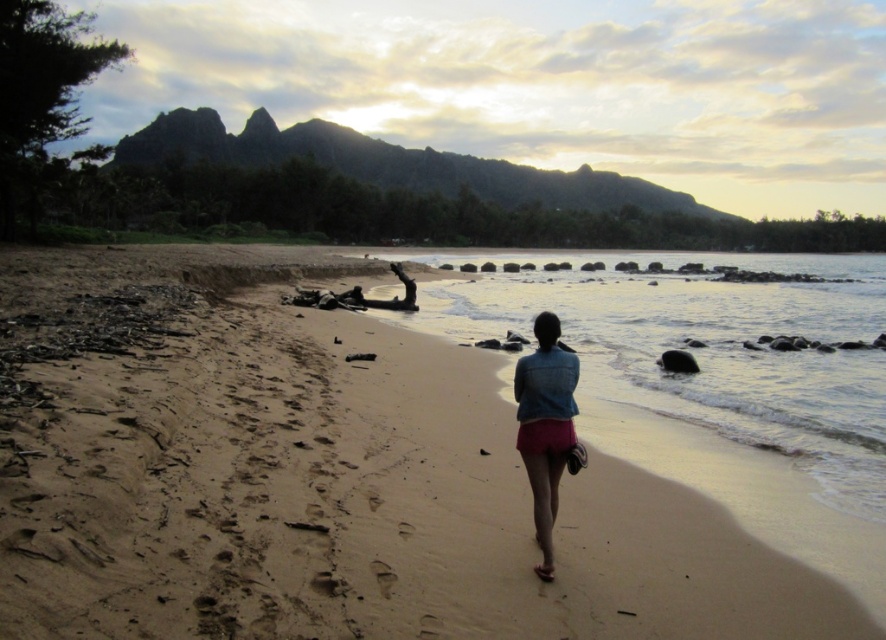
Question: Considering the relative positions of sandy beach at center and pink denim shorts at center in the image provided, where is sandy beach at center located with respect to pink denim shorts at center?

Choices:
 (A) left
 (B) right

Answer: (A)

Question: Which is farther from the pink denim shorts at center?

Choices:
 (A) sandy beach at center
 (B) clear water at center

Answer: (B)

Question: Does sandy beach at center have a smaller size compared to pink denim shorts at center?

Choices:
 (A) yes
 (B) no

Answer: (B)

Question: Which is nearer to the pink denim shorts at center?

Choices:
 (A) sandy beach at center
 (B) clear water at center

Answer: (A)

Question: Based on their relative distances, which object is nearer to the clear water at center?

Choices:
 (A) sandy beach at center
 (B) pink denim shorts at center

Answer: (A)

Question: Is sandy beach at center bigger than pink denim shorts at center?

Choices:
 (A) yes
 (B) no

Answer: (A)